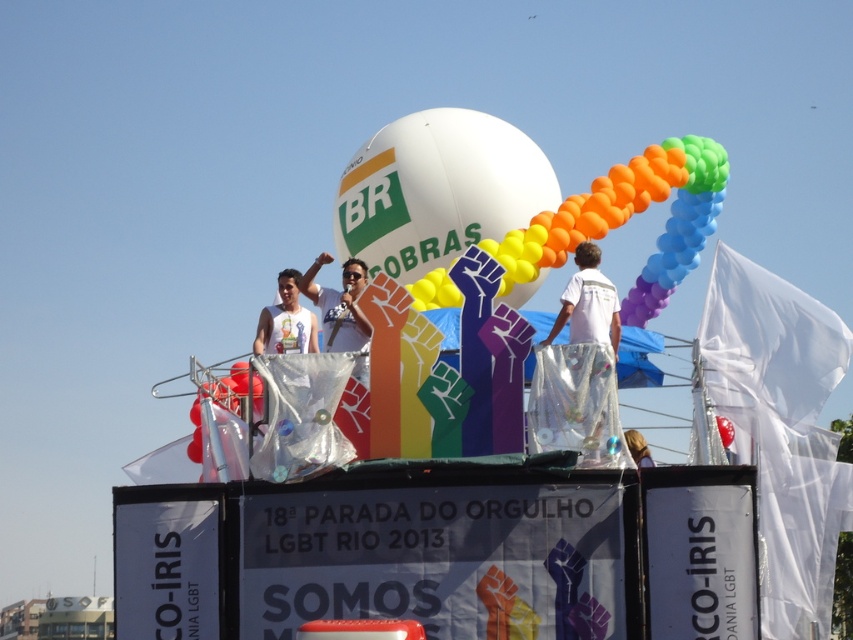
Who is positioned more to the right, white shiny pants at center or white matte tank top at center?

Positioned to the right is white shiny pants at center.

Measure the distance between white shiny pants at center and white matte tank top at center.

white shiny pants at center is 13.65 meters from white matte tank top at center.

Does point (560, 312) lie in front of point (262, 342)?

Yes, point (560, 312) is in front of point (262, 342).

Where is `white shiny pants at center`? white shiny pants at center is located at coordinates (589, 304).

Who is higher up, rainbow balloons at center or white shiny pants at center?

Positioned higher is rainbow balloons at center.

Is point (680, 214) positioned in front of point (608, 328)?

No, (680, 214) is behind (608, 328).

Where is `rainbow balloons at center`? This screenshot has width=853, height=640. rainbow balloons at center is located at coordinates (630, 218).

Does rainbow balloons at center appear over white matte tank top at center?

Correct, rainbow balloons at center is located above white matte tank top at center.

Is rainbow balloons at center taller than white matte tank top at center?

Correct, rainbow balloons at center is much taller as white matte tank top at center.

Who is more forward, (683,230) or (256,332)?

Positioned in front is point (683,230).

Where is `rainbow balloons at center`? The image size is (853, 640). rainbow balloons at center is located at coordinates (630, 218).